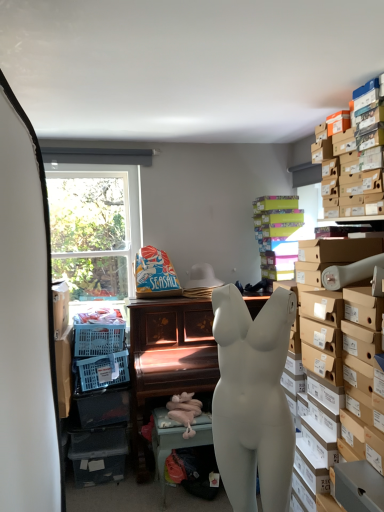
Question: Which direction should I rotate to face seaside-themed paper bag at center, placed as the 1th toy when sorted from top to bottom, — up or down?

Choices:
 (A) down
 (B) up

Answer: (A)

Question: Is brown cardboard boxes at upper right, which is the first shelf in front-to-back order, surrounding multicolored cardboard boxes at upper right, placed as the 2th shelf when sorted from front to back?

Choices:
 (A) no
 (B) yes

Answer: (A)

Question: Can you confirm if brown cardboard boxes at upper right, which is the first shelf in front-to-back order, is thinner than multicolored cardboard boxes at upper right, placed as the 2th shelf when sorted from front to back?

Choices:
 (A) no
 (B) yes

Answer: (B)

Question: Is brown cardboard boxes at upper right, which is the second shelf from back to front, at the left side of multicolored cardboard boxes at upper right, placed as the 2th shelf when sorted from front to back?

Choices:
 (A) no
 (B) yes

Answer: (A)

Question: From a real-world perspective, is brown cardboard boxes at upper right, which is the first shelf in front-to-back order, located beneath multicolored cardboard boxes at upper right, placed as the 2th shelf when sorted from front to back?

Choices:
 (A) no
 (B) yes

Answer: (A)

Question: Can you confirm if brown cardboard boxes at upper right, which is the second shelf from back to front, is positioned to the right of multicolored cardboard boxes at upper right, placed as the 2th shelf when sorted from front to back?

Choices:
 (A) yes
 (B) no

Answer: (A)

Question: Is brown cardboard boxes at upper right, which is the first shelf in front-to-back order, aimed at multicolored cardboard boxes at upper right, which ranks as the 1th shelf in back-to-front order?

Choices:
 (A) no
 (B) yes

Answer: (A)

Question: Can you confirm if white matte mannequin torso at center is positioned to the left of wooden piano at center, the first table viewed from the back?

Choices:
 (A) yes
 (B) no

Answer: (B)

Question: Is white matte mannequin torso at center positioned with its back to wooden piano at center, the first table viewed from the back?

Choices:
 (A) no
 (B) yes

Answer: (A)

Question: Is white matte mannequin torso at center closer to camera compared to wooden piano at center, the first table viewed from the back?

Choices:
 (A) yes
 (B) no

Answer: (A)

Question: Is white matte mannequin torso at center taller than wooden piano at center, which is the 2th table from front to back?

Choices:
 (A) yes
 (B) no

Answer: (B)

Question: Is white matte mannequin torso at center bigger than wooden piano at center, the first table viewed from the back?

Choices:
 (A) no
 (B) yes

Answer: (A)

Question: From a real-world perspective, is white matte mannequin torso at center under wooden piano at center, the first table viewed from the back?

Choices:
 (A) no
 (B) yes

Answer: (A)

Question: Is there a large distance between brown cardboard boxes at upper right, which is the second shelf from back to front, and wooden piano at center, the first table viewed from the back?

Choices:
 (A) yes
 (B) no

Answer: (A)